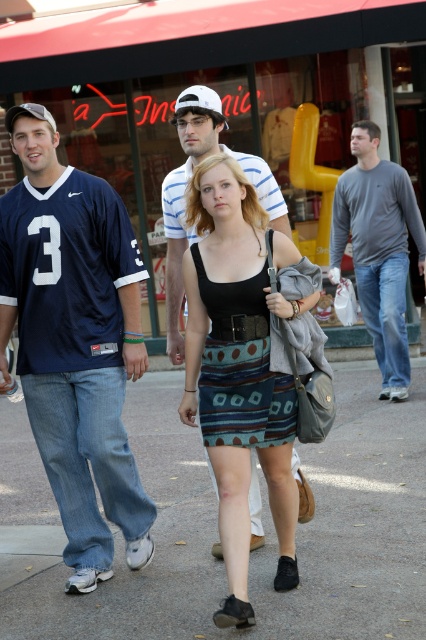
You are a delivery robot positioned at the origin point of the scene. Your task is to deliver a package to the gray concrete pavement at center. What are the coordinates you should navigate to?

The gray concrete pavement at center is located at coordinates point (265,532), so you should navigate to point (265,532).

You are a photographer standing on the sidewalk. You want to take a photo of the gray cotton shirt at center and the white matte baseball cap at center. Which object should you zoom in on to capture more detail?

The gray cotton shirt at center has a larger size compared to the white matte baseball cap at center, so you should zoom in on the white matte baseball cap at center to capture more detail.

You are a delivery person carrying a box that is 3 meters long. You need to walk through the street scene shown in the image. Is there enough space between the gray concrete pavement at center and the striped cotton shirt at center to pass through with your box?

The distance between the gray concrete pavement at center and the striped cotton shirt at center is 2.63 meters. Since your box is 3 meters long, it is longer than the available space. Therefore, you cannot pass through with your box.